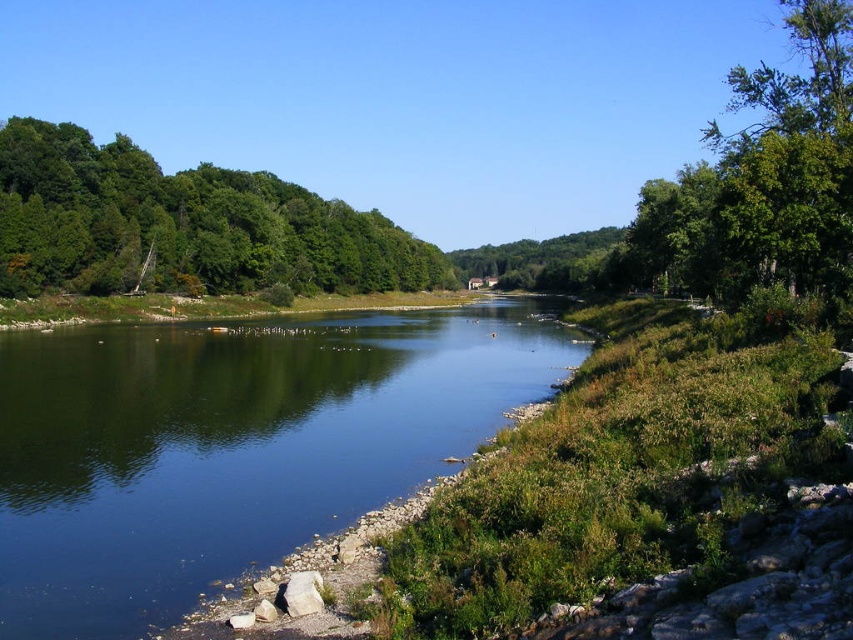
Looking at this image, you are an environmental scientist assessing the biodiversity of this area. You observe the green leafy tree at upper left and the green leafy tree at upper right in the image. Which tree would likely have a smaller canopy area based on their spatial representation?

The green leafy tree at upper left occupies less space than the green leafy tree at upper right, indicating it has a smaller canopy area.

You are standing on the left bank of the river and want to cross to the right bank. You notice the green smooth water at center and the green leafy tree at upper left. Which object is closer to you, the observer?

The green smooth water at center is closer to you than the green leafy tree at upper left because it is positioned at the center of the image, while the tree is at the upper left, which is further away in the background.